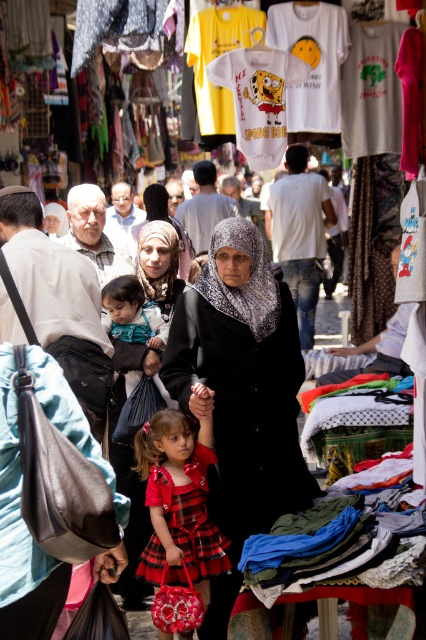
You are a vendor in the market who wants to place a new item between the matte black hijab at center and the teal satin dress at center. The item is 20 inches long. Will there be enough space to place it between them?

The distance between the matte black hijab at center and the teal satin dress at center is 24.57 inches. Since the item is 20 inches long, there is enough space to place it between them.

You are a photographer trying to capture a photo of the black matte coat at center and the plaid fabric dress at center. Since you want both subjects to be clearly visible in the frame, which one should you position closer to the camera to ensure both are in focus?

The black matte coat at center is positioned on the right side of the plaid fabric dress at center. To ensure both are in focus, position the plaid fabric dress at center closer to the camera so that the distance between them is minimized.

You are a vendor in the market and want to show a customer the white cotton shirt at center and the teal satin dress at center. Which item is closer to the customer?

The white cotton shirt at center is closer to the customer because it is further to the viewer than the teal satin dress at center.